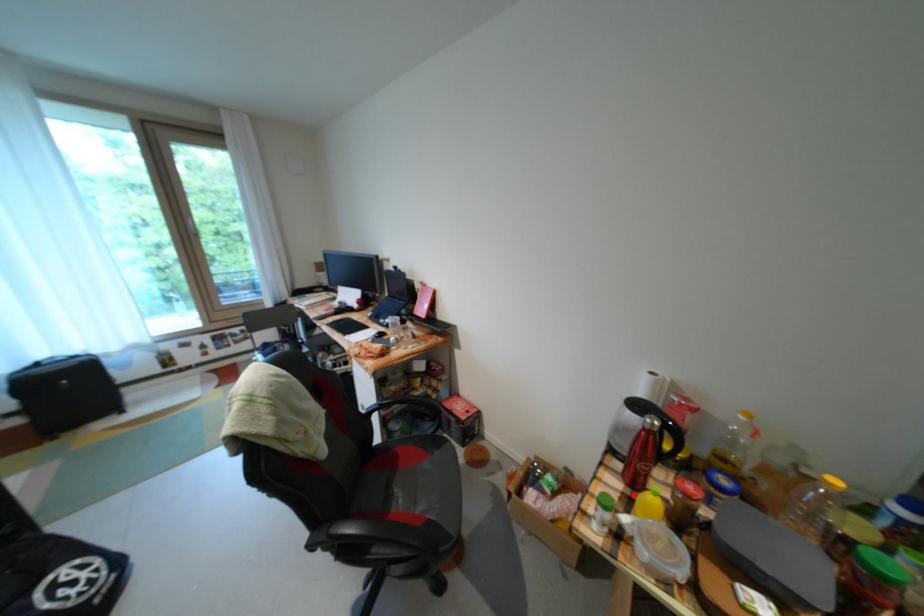
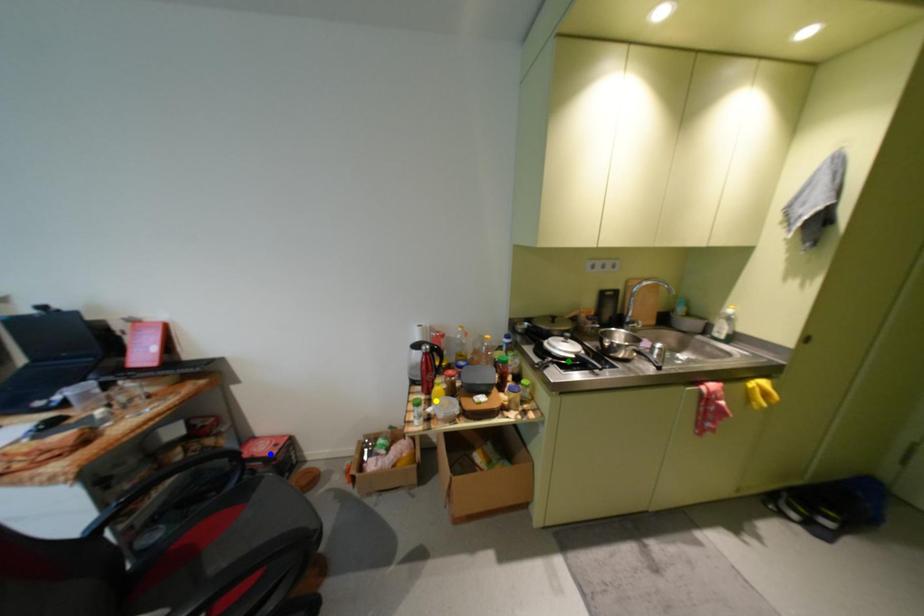
Question: I am providing you with two images of the same scene from different viewpoints. A red point is marked on the first image. You are given multiple points on the second image. Which spot in image 2 lines up with the point in image 1?

Choices:
 (A) blue point
 (B) yellow point
 (C) green point

Answer: (B)